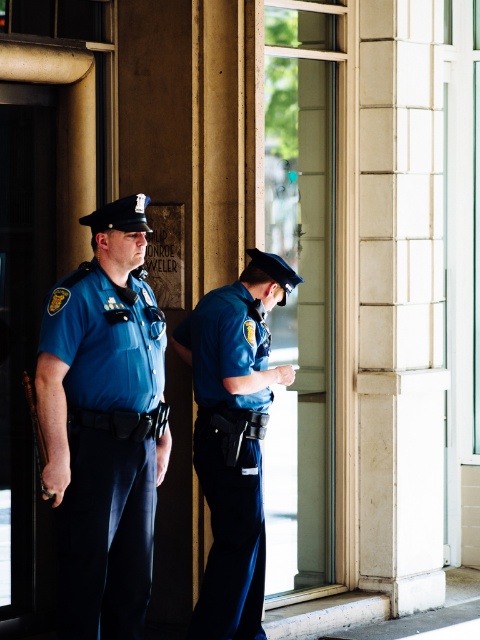
You are an interior designer planning to place a new decorative item between the white marble pillar at right and the matte blue uniform at left. Based on their positions, which object should the item be closer to?

The white marble pillar at right is closer to the viewer than the matte blue uniform at left, so the decorative item should be placed closer to the matte blue uniform at left to maintain balance.

You are a visitor in the building and need to locate the emergency exit. You see the white marble pillar at right and the matte blue uniform at left. Which object is positioned to the right of the other?

The white marble pillar at right is to the right of the matte blue uniform at left.

Based on the scene description, which officer is positioned higher in the image, the matte blue uniform at left or the blue uniform at right?

The matte blue uniform at left is positioned higher than the blue uniform at right in the image.